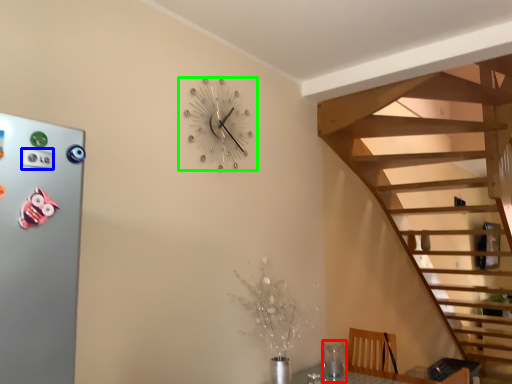
Question: Which object is positioned farthest from glass vase (highlighted by a red box)? Select from button (highlighted by a blue box) and wall clock (highlighted by a green box).

Choices:
 (A) button
 (B) wall clock

Answer: (A)